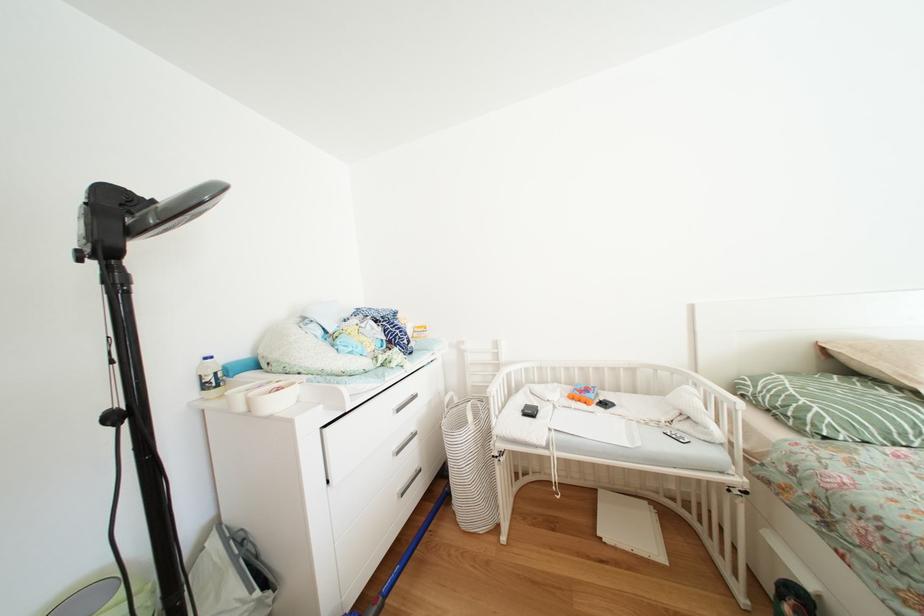
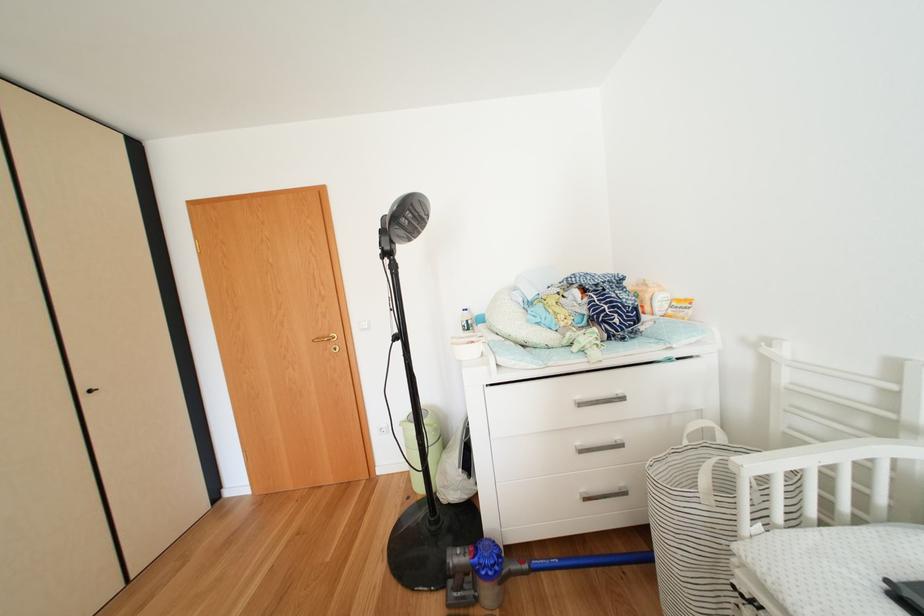
Question: The images are taken continuously from a first-person perspective. In which direction is your viewpoint rotating?

Choices:
 (A) Left
 (B) Right
 (C) Up
 (D) Down

Answer: (A)